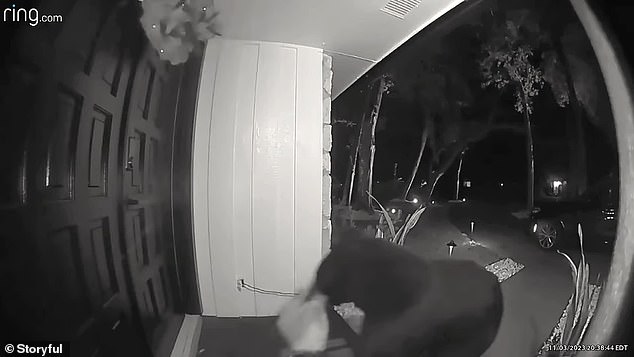
Find the location of `ceiling ventilation above the door`. ceiling ventilation above the door is located at coordinates 397,12.